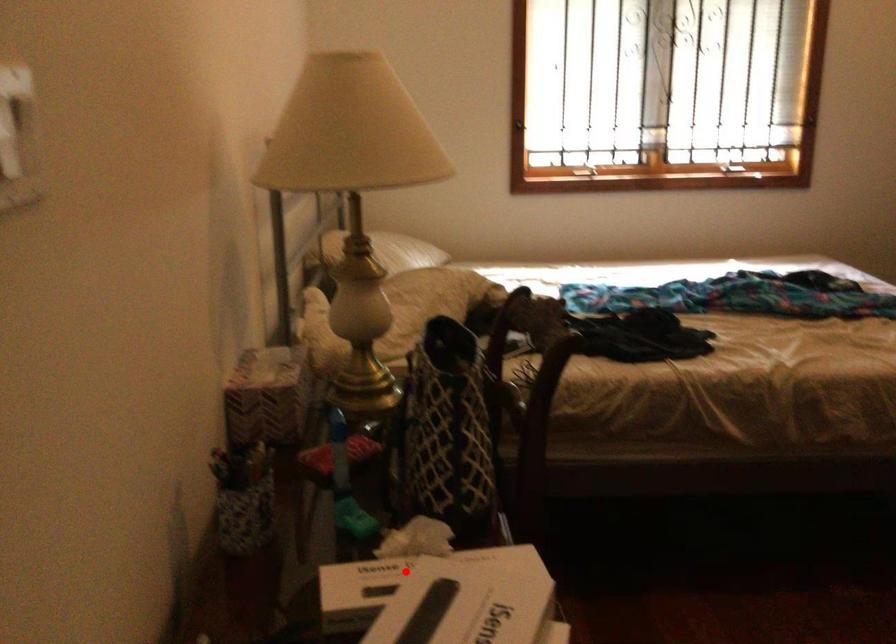
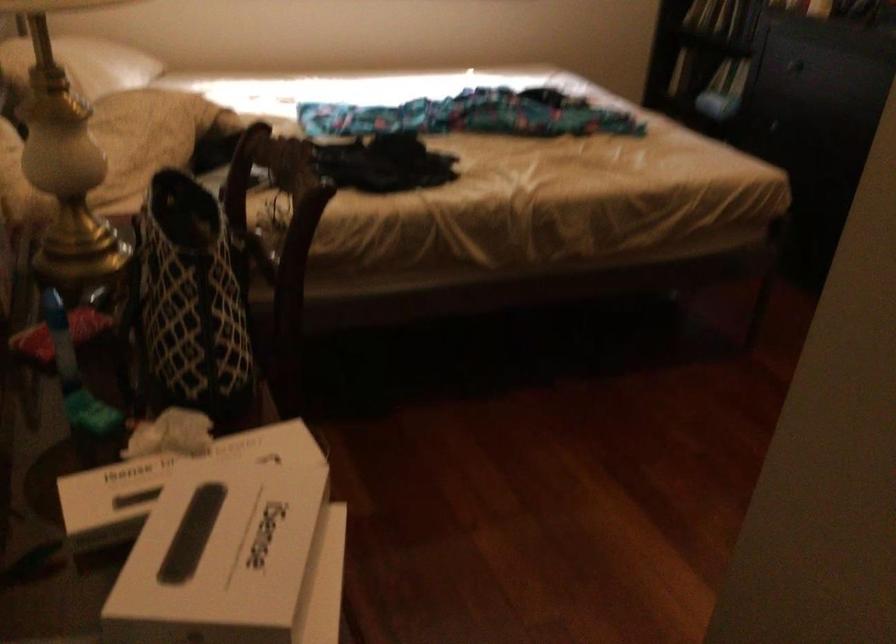
In the second image, find the point that corresponds to the highlighted location in the first image.

(168, 477)